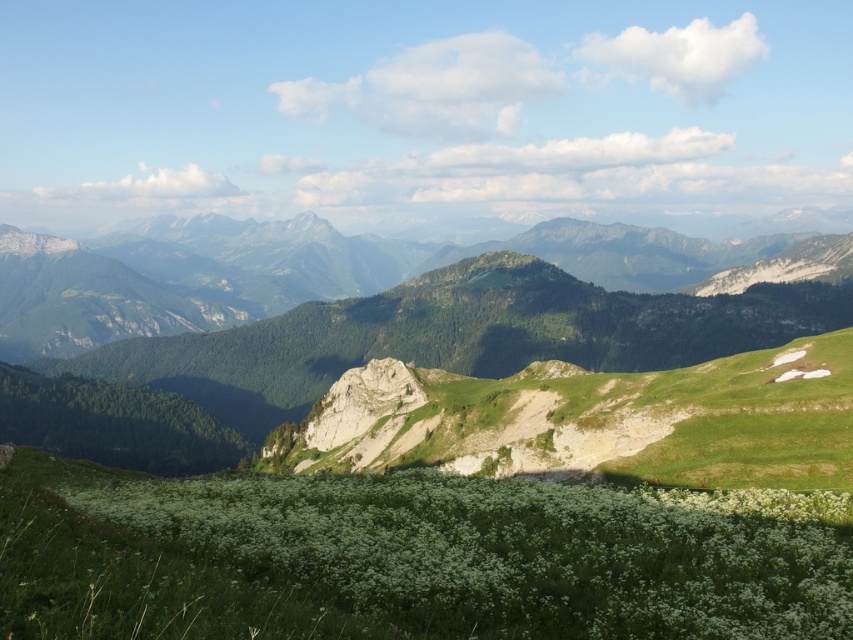
Question: Does green leafy grass at center appear over green grassy mountain range at center?

Choices:
 (A) yes
 (B) no

Answer: (B)

Question: Is green leafy grass at center positioned before green grassy mountain range at center?

Choices:
 (A) no
 (B) yes

Answer: (B)

Question: Does green leafy grass at center have a larger size compared to green grassy mountain range at center?

Choices:
 (A) yes
 (B) no

Answer: (B)

Question: Which point is farther from the camera taking this photo?

Choices:
 (A) (851, 609)
 (B) (105, 326)

Answer: (B)

Question: Among these points, which one is nearest to the camera?

Choices:
 (A) (61, 620)
 (B) (148, 266)

Answer: (A)

Question: Which object is closer to the camera taking this photo?

Choices:
 (A) green grassy mountain range at center
 (B) green leafy grass at center

Answer: (B)